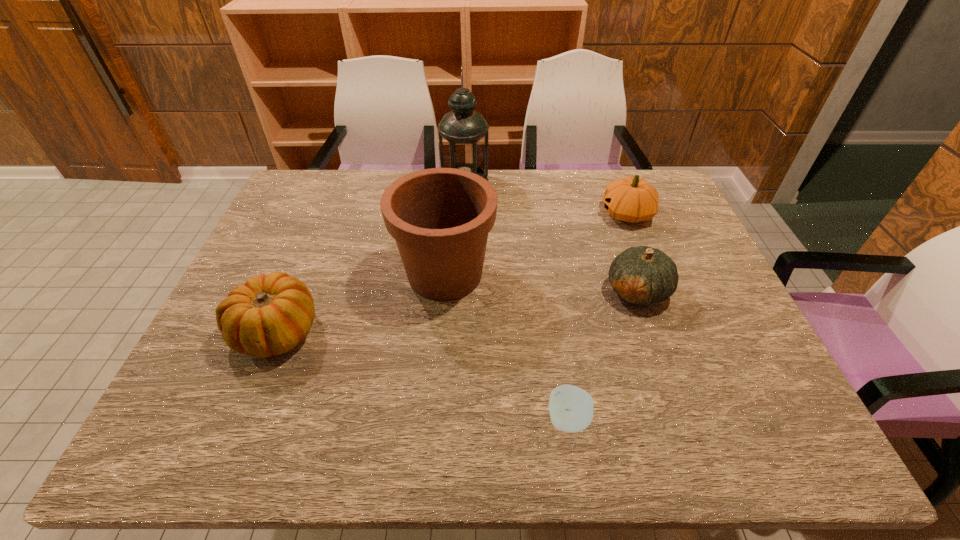
Image resolution: width=960 pixels, height=540 pixels. Find the location of `free location located on the side of the second farthest object with the carved face`. free location located on the side of the second farthest object with the carved face is located at coordinates (518, 214).

Locate an element on the screen. The image size is (960, 540). free spot located 0.090m on the side of the second farthest object with the carved face is located at coordinates (571, 214).

The image size is (960, 540). I want to click on free space located 0.130m on the right of the leftmost object, so click(x=373, y=332).

You are a GUI agent. You are given a task and a screenshot of the screen. Output one action in this format:
    pyautogui.click(x=<x>, y=<y>)
    Task: Click on the free region located 0.300m on the back of the shortest object
    This screenshot has height=540, width=960.
    Given the screenshot: What is the action you would take?
    pyautogui.click(x=550, y=296)

This screenshot has width=960, height=540. I want to click on oil lamp positioned at the far edge, so click(463, 133).

Find the location of a particular element. This screenshot has height=540, width=960. gourd that is positioned at the far edge is located at coordinates (632, 199).

Find the location of a particular element. The width and height of the screenshot is (960, 540). object situated at the near edge is located at coordinates (571, 408).

Locate an element on the screen. Image resolution: width=960 pixels, height=540 pixels. object at the left edge is located at coordinates (271, 314).

Where is `object that is at the far right corner`? object that is at the far right corner is located at coordinates (632, 199).

This screenshot has height=540, width=960. In the image, there is a desktop. Find the location of `free space at the far edge`. free space at the far edge is located at coordinates (504, 182).